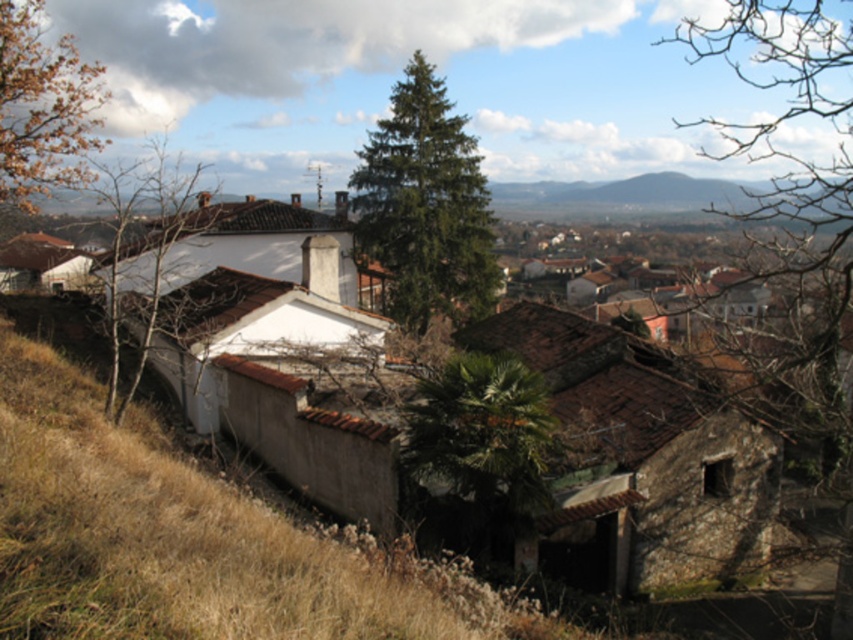
You are a photographer standing on the hillside and want to capture both the rusty metal roof at center and the green leafy palm at center in the same frame. Which object will appear closer to the camera in your photo?

The rusty metal roof at center will appear closer to the camera because it is in front of the green leafy palm at center.